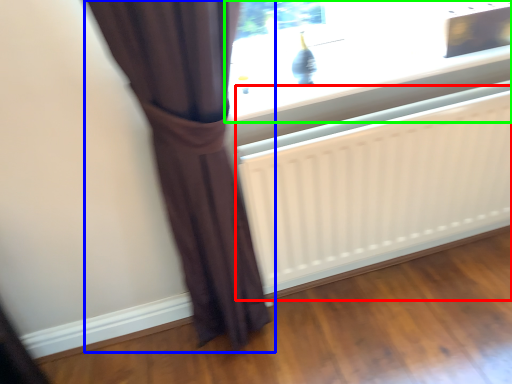
Question: Which object is positioned closest to radiator (highlighted by a red box)? Select from curtain (highlighted by a blue box) and window (highlighted by a green box).

Choices:
 (A) curtain
 (B) window

Answer: (B)